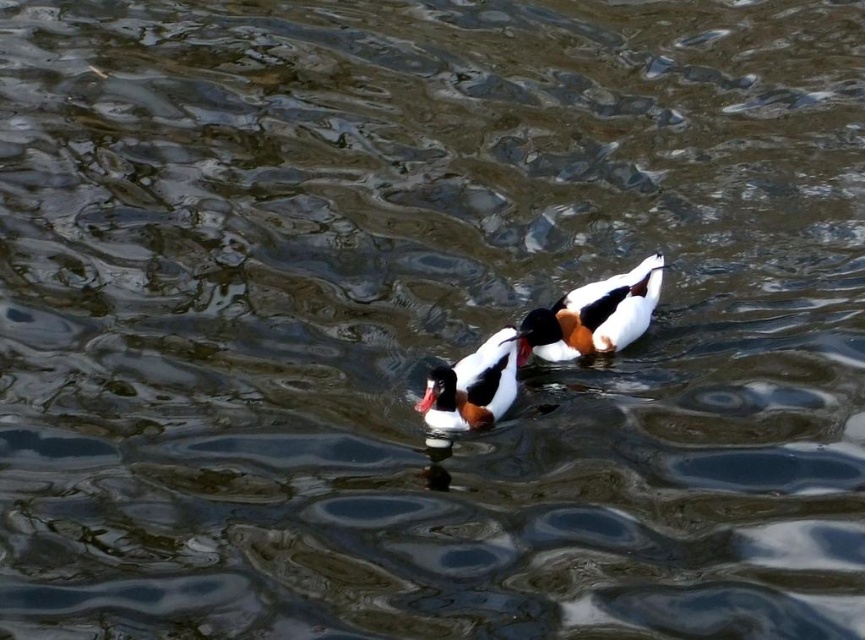
Question: Which object is closer to the camera taking this photo?

Choices:
 (A) white glossy duck at center
 (B) white fluffy duck at center

Answer: (B)

Question: Among these objects, which one is farthest from the camera?

Choices:
 (A) white fluffy duck at center
 (B) white glossy duck at center

Answer: (B)

Question: Does white glossy duck at center appear on the right side of white fluffy duck at center?

Choices:
 (A) yes
 (B) no

Answer: (A)

Question: Is white glossy duck at center further to camera compared to white fluffy duck at center?

Choices:
 (A) no
 (B) yes

Answer: (B)

Question: Can you confirm if white glossy duck at center is positioned below white fluffy duck at center?

Choices:
 (A) yes
 (B) no

Answer: (B)